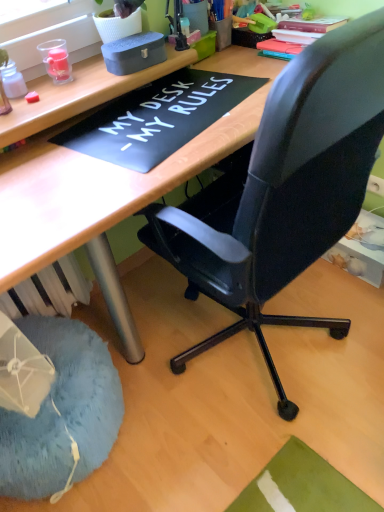
Question: From the image's perspective, is wooden desk at center located above or below translucent plastic bottle at upper left, which is the second stationery from right to left?

Choices:
 (A) below
 (B) above

Answer: (A)

Question: In the image, is wooden desk at center positioned in front of or behind translucent plastic bottle at upper left, which is the second stationery from right to left?

Choices:
 (A) front
 (B) behind

Answer: (A)

Question: Which is farther from the matte gray box at upper center, the 2th stationery from the left?

Choices:
 (A) wooden desk at center
 (B) translucent plastic bottle at upper left, which is the 1th stationery in left-to-right order
 (C) blue fuzzy bean bag at lower left

Answer: (C)

Question: Which object is positioned farthest from the translucent plastic bottle at upper left, which is the second stationery from right to left?

Choices:
 (A) matte gray box at upper center, the 2th stationery from the left
 (B) blue fuzzy bean bag at lower left
 (C) wooden desk at center

Answer: (B)